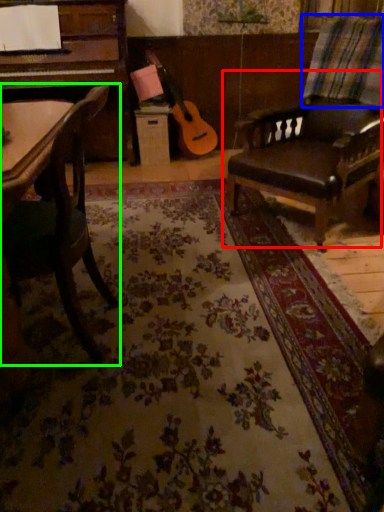
Question: Considering the real-world distances, which object is closest to chair (highlighted by a red box)? plaid (highlighted by a blue box) or chair (highlighted by a green box).

Choices:
 (A) plaid
 (B) chair

Answer: (A)